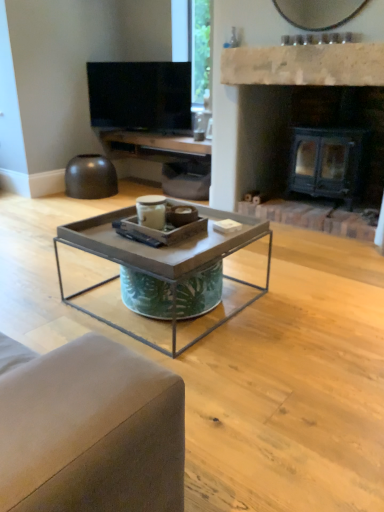
This screenshot has height=512, width=384. Find the location of `free point below white stone fireplace at upper center (from a real-world perspective)`. free point below white stone fireplace at upper center (from a real-world perspective) is located at coordinates (308, 227).